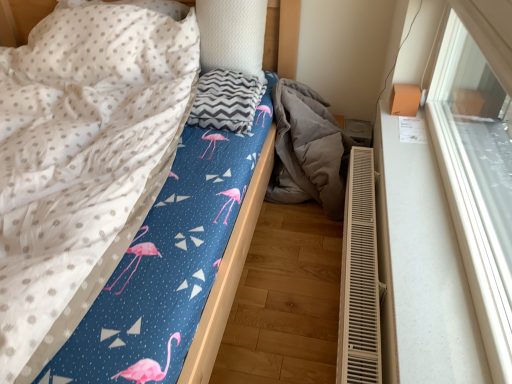
Question: Is white plastic radiator at lower right bigger than blue fabric bed at center?

Choices:
 (A) no
 (B) yes

Answer: (A)

Question: Does white plastic radiator at lower right appear on the left side of blue fabric bed at center?

Choices:
 (A) yes
 (B) no

Answer: (B)

Question: From the image's perspective, would you say white plastic radiator at lower right is shown under blue fabric bed at center?

Choices:
 (A) yes
 (B) no

Answer: (A)

Question: Is white plastic radiator at lower right far away from blue fabric bed at center?

Choices:
 (A) yes
 (B) no

Answer: (B)

Question: Can you confirm if white plastic radiator at lower right is smaller than blue fabric bed at center?

Choices:
 (A) yes
 (B) no

Answer: (A)

Question: Is white plastic radiator at lower right positioned beyond the bounds of blue fabric bed at center?

Choices:
 (A) no
 (B) yes

Answer: (B)

Question: From a real-world perspective, is blue fabric bed at center on top of white glossy window sill at upper right?

Choices:
 (A) no
 (B) yes

Answer: (A)

Question: From the image's perspective, is blue fabric bed at center on top of white glossy window sill at upper right?

Choices:
 (A) yes
 (B) no

Answer: (B)

Question: Does blue fabric bed at center appear on the right side of white glossy window sill at upper right?

Choices:
 (A) no
 (B) yes

Answer: (A)

Question: Considering the relative positions of blue fabric bed at center and white glossy window sill at upper right in the image provided, is blue fabric bed at center to the left of white glossy window sill at upper right from the viewer's perspective?

Choices:
 (A) no
 (B) yes

Answer: (B)

Question: Considering the relative sizes of blue fabric bed at center and white glossy window sill at upper right in the image provided, is blue fabric bed at center smaller than white glossy window sill at upper right?

Choices:
 (A) yes
 (B) no

Answer: (B)

Question: Does blue fabric bed at center have a lesser height compared to white glossy window sill at upper right?

Choices:
 (A) yes
 (B) no

Answer: (B)

Question: Can you confirm if white plastic radiator at lower right is wider than white textured pillow at upper center?

Choices:
 (A) yes
 (B) no

Answer: (B)